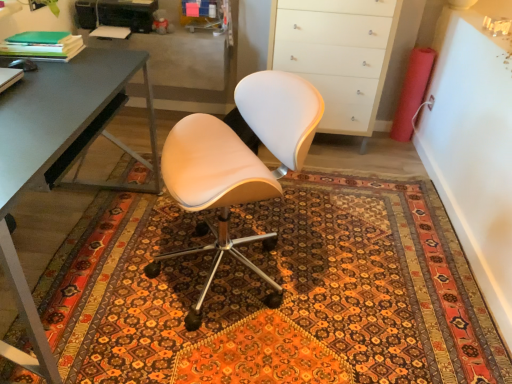
Question: In terms of width, does green matte folder at upper left look wider or thinner when compared to matte white chair at center?

Choices:
 (A) wide
 (B) thin

Answer: (B)

Question: Relative to matte white chair at center, is green matte folder at upper left in front or behind?

Choices:
 (A) front
 (B) behind

Answer: (B)

Question: Considering the real-world distances, which object is farthest from the green matte folder at upper left?

Choices:
 (A) white glossy cabinet at upper right
 (B) patterned carpet at center
 (C) matte white chair at center
 (D) metallic gray desk at left

Answer: (A)

Question: Based on their relative distances, which object is nearer to the white glossy cabinet at upper right?

Choices:
 (A) metallic gray desk at left
 (B) green matte folder at upper left
 (C) matte white chair at center
 (D) patterned carpet at center

Answer: (D)